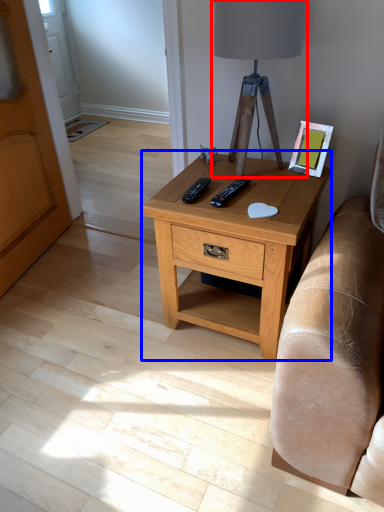
Question: Which point is closer to the camera, table lamp (highlighted by a red box) or nightstand (highlighted by a blue box)?

Choices:
 (A) table lamp
 (B) nightstand

Answer: (A)